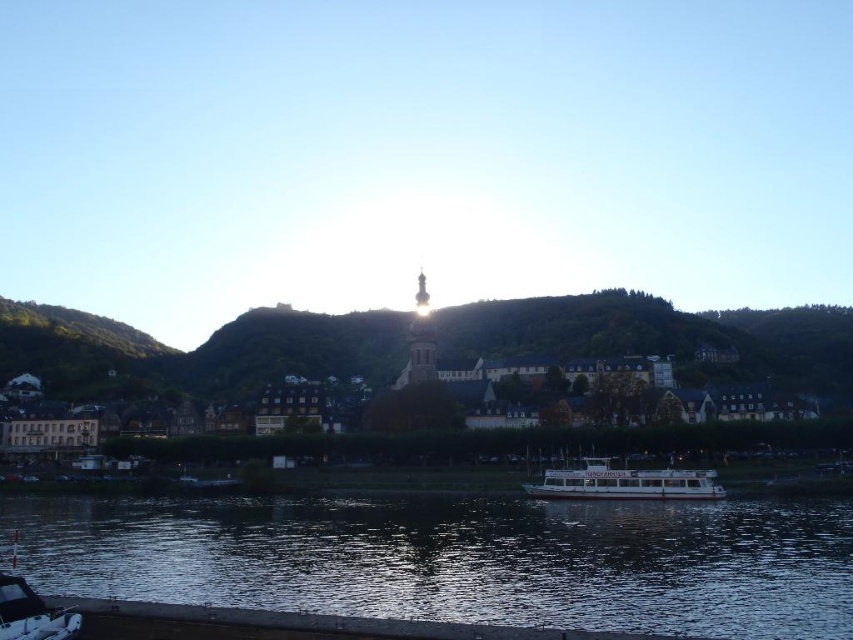
Question: Does dark reflective water at lower center have a smaller size compared to white plastic boat at lower left?

Choices:
 (A) no
 (B) yes

Answer: (A)

Question: Can you confirm if white glossy boat at lower center is wider than white plastic boat at lower left?

Choices:
 (A) yes
 (B) no

Answer: (A)

Question: Is dark reflective water at lower center positioned in front of white plastic boat at lower left?

Choices:
 (A) no
 (B) yes

Answer: (A)

Question: Estimate the real-world distances between objects in this image. Which object is closer to the matte stone buildings at center?

Choices:
 (A) white plastic boat at lower left
 (B) dark reflective water at lower center

Answer: (B)

Question: Considering the real-world distances, which object is farthest from the white plastic boat at lower left?

Choices:
 (A) matte stone buildings at center
 (B) white glossy boat at lower center
 (C) dark reflective water at lower center

Answer: (A)

Question: Among these objects, which one is nearest to the camera?

Choices:
 (A) matte stone buildings at center
 (B) white glossy boat at lower center

Answer: (B)